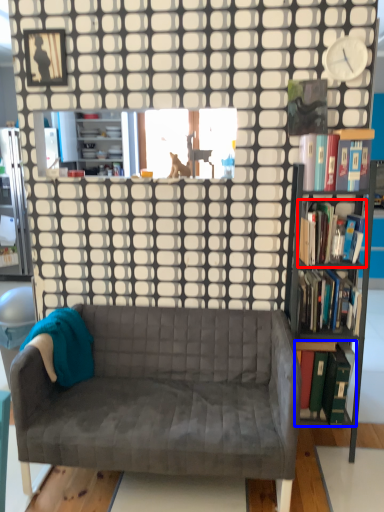
Question: Which point is closer to the camera, book (highlighted by a red box) or book (highlighted by a blue box)?

Choices:
 (A) book
 (B) book

Answer: (A)